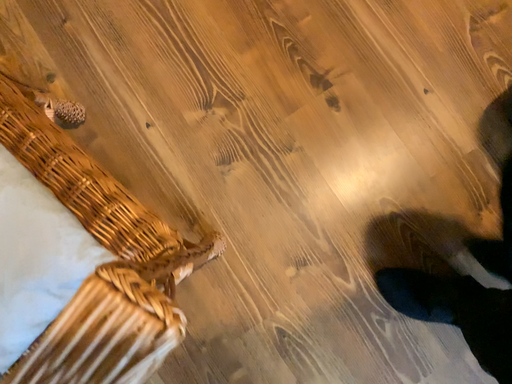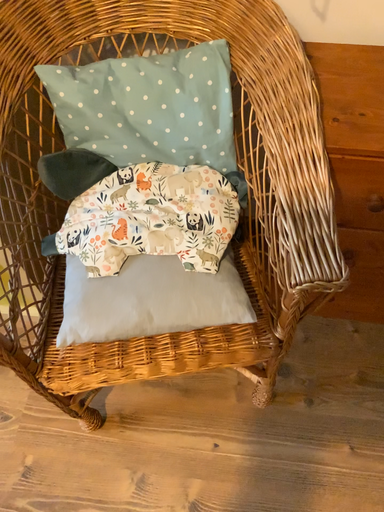
Question: How did the camera likely rotate when shooting the video?

Choices:
 (A) rotated right
 (B) rotated left

Answer: (B)